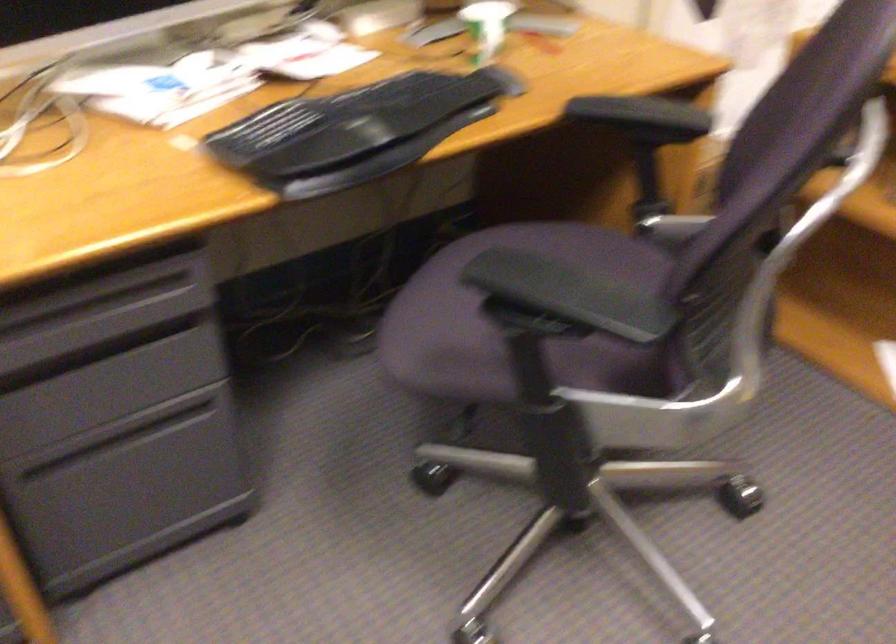
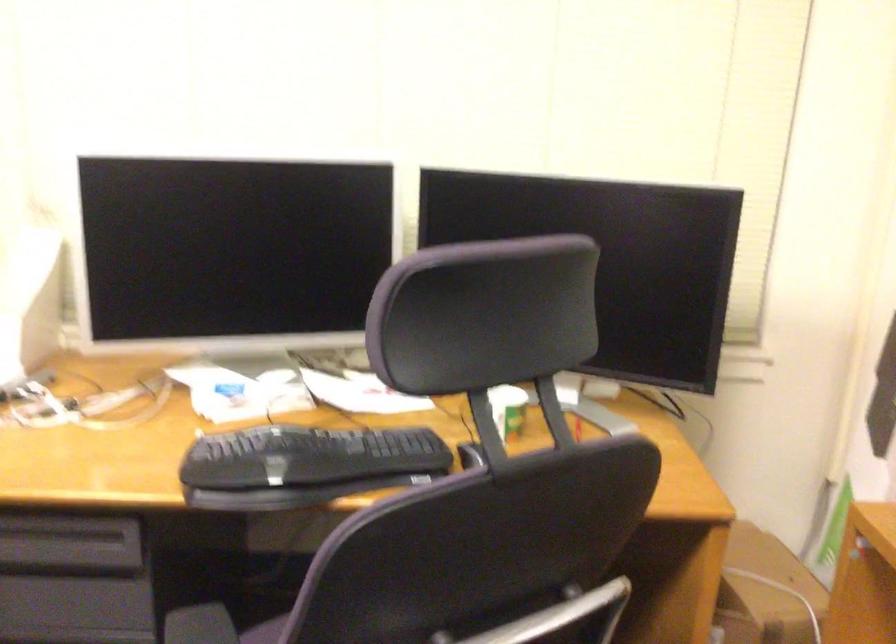
Locate, in the second image, the point that corresponds to pixel 119 323 in the first image.

(66, 552)